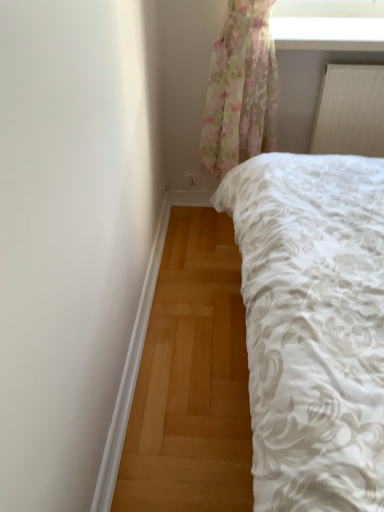
Question: Can you see white smooth trim at lower left touching white matte radiator at upper right?

Choices:
 (A) no
 (B) yes

Answer: (A)

Question: Is white smooth trim at lower left closer to camera compared to white matte radiator at upper right?

Choices:
 (A) yes
 (B) no

Answer: (A)

Question: Does white smooth trim at lower left have a lesser height compared to white matte radiator at upper right?

Choices:
 (A) no
 (B) yes

Answer: (B)

Question: Does white smooth trim at lower left have a lesser width compared to white matte radiator at upper right?

Choices:
 (A) yes
 (B) no

Answer: (A)

Question: Considering the relative sizes of white smooth trim at lower left and white matte radiator at upper right in the image provided, is white smooth trim at lower left bigger than white matte radiator at upper right?

Choices:
 (A) yes
 (B) no

Answer: (B)

Question: In terms of height, does white matte radiator at upper right look taller or shorter compared to white smooth trim at lower left?

Choices:
 (A) tall
 (B) short

Answer: (A)

Question: Is white matte radiator at upper right in front of or behind white smooth trim at lower left in the image?

Choices:
 (A) behind
 (B) front

Answer: (A)

Question: In terms of size, does white matte radiator at upper right appear bigger or smaller than white smooth trim at lower left?

Choices:
 (A) small
 (B) big

Answer: (B)

Question: Is white matte radiator at upper right spatially inside white smooth trim at lower left, or outside of it?

Choices:
 (A) outside
 (B) inside

Answer: (A)

Question: Is transparent floral curtain at upper center taller or shorter than white matte radiator at upper right?

Choices:
 (A) tall
 (B) short

Answer: (B)

Question: Looking at their shapes, would you say transparent floral curtain at upper center is wider or thinner than white matte radiator at upper right?

Choices:
 (A) wide
 (B) thin

Answer: (A)

Question: From a real-world perspective, is transparent floral curtain at upper center physically located above or below white matte radiator at upper right?

Choices:
 (A) above
 (B) below

Answer: (A)

Question: Would you say transparent floral curtain at upper center is inside or outside white matte radiator at upper right?

Choices:
 (A) inside
 (B) outside

Answer: (B)

Question: Is transparent floral curtain at upper center inside the boundaries of white smooth trim at lower left, or outside?

Choices:
 (A) inside
 (B) outside

Answer: (B)

Question: Looking at their shapes, would you say transparent floral curtain at upper center is wider or thinner than white smooth trim at lower left?

Choices:
 (A) thin
 (B) wide

Answer: (B)